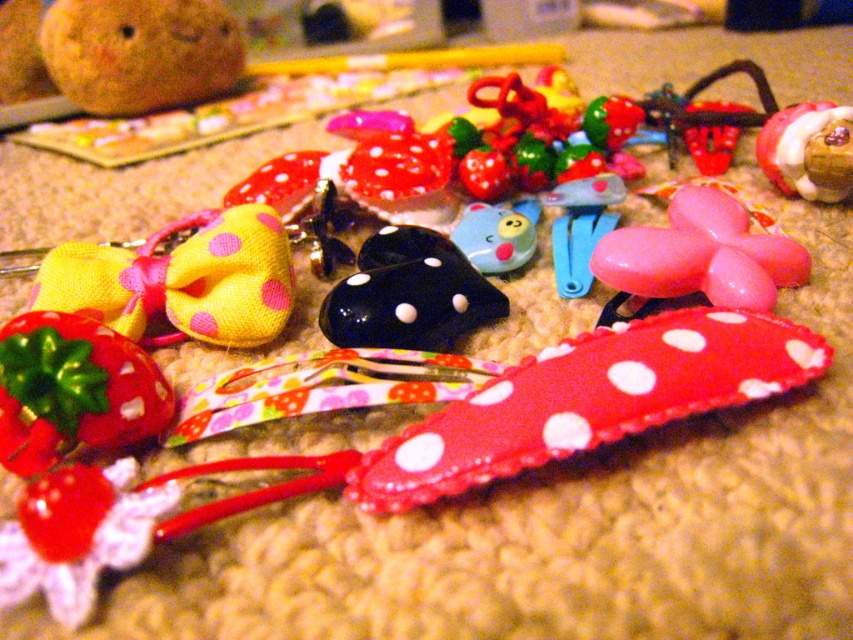
Can you confirm if yellow fabric bow at left is shorter than matte brown wooden toy at upper right?

Yes, yellow fabric bow at left is shorter than matte brown wooden toy at upper right.

The width and height of the screenshot is (853, 640). Describe the element at coordinates (181, 280) in the screenshot. I see `yellow fabric bow at left` at that location.

Is point (45, 268) less distant than point (848, 168)?

Yes, it is.

Identify the location of yellow fabric bow at left. This screenshot has height=640, width=853. (181, 280).

Between matte red fabric bow at upper left and matte brown wooden toy at upper right, which one appears on the left side from the viewer's perspective?

matte red fabric bow at upper left is more to the left.

Is point (47, 310) in front of point (788, 148)?

Yes, it is in front of point (788, 148).

Which is in front, point (28, 326) or point (782, 144)?

Point (28, 326)

Identify the location of matte red fabric bow at upper left. (73, 390).

Can you confirm if matte brown wooden toy at upper right is taller than blue rubber duck at center?

Correct, matte brown wooden toy at upper right is much taller as blue rubber duck at center.

Who is more distant from viewer, (x=821, y=131) or (x=477, y=250)?

Point (x=821, y=131)

Locate an element on the screen. This screenshot has width=853, height=640. matte brown wooden toy at upper right is located at coordinates (808, 150).